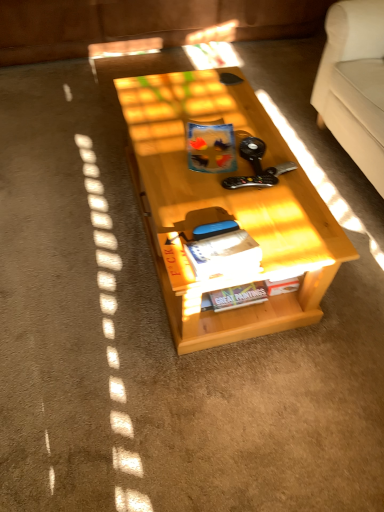
I want to click on vacant area that lies to the right of hardcover book at center, which appears as the first book when viewed from the front, so click(289, 237).